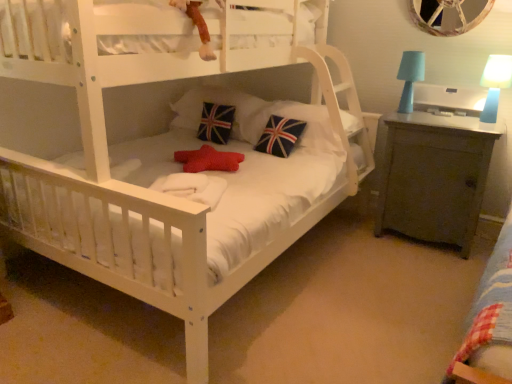
Question: Do you think union jack fabric pillow at center, acting as the 3th pillow starting from the right, is within velvety plush monkey at upper center, or outside of it?

Choices:
 (A) outside
 (B) inside

Answer: (A)

Question: From their relative heights in the image, would you say union jack fabric pillow at center, which ranks as the 1th pillow in left-to-right order, is taller or shorter than velvety plush monkey at upper center?

Choices:
 (A) tall
 (B) short

Answer: (A)

Question: Estimate the real-world distances between objects in this image. Which object is farther from the union jack fabric pillow at center, acting as the 3th pillow starting from the right?

Choices:
 (A) matte blue lampshade at upper right, which is the 1th table lamp in left-to-right order
 (B) matte gray cabinet at right
 (C) union jack fabric pillow at center, the 2th pillow when ordered from left to right
 (D) blue plastic table lamp at upper right, which ranks as the second table lamp in left-to-right order
 (E) velvety plush monkey at upper center

Answer: (D)

Question: Which object is the farthest from the blue plastic table lamp at upper right, placed as the first table lamp when sorted from right to left?

Choices:
 (A) matte blue lampshade at upper right, positioned as the second table lamp in right-to-left order
 (B) union jack fabric pillow at center, which ranks as the 1th pillow in right-to-left order
 (C) velvety plush monkey at upper center
 (D) union jack fabric pillow at center, which ranks as the 1th pillow in left-to-right order
 (E) union jack fabric pillow at center, acting as the second pillow starting from the right

Answer: (D)